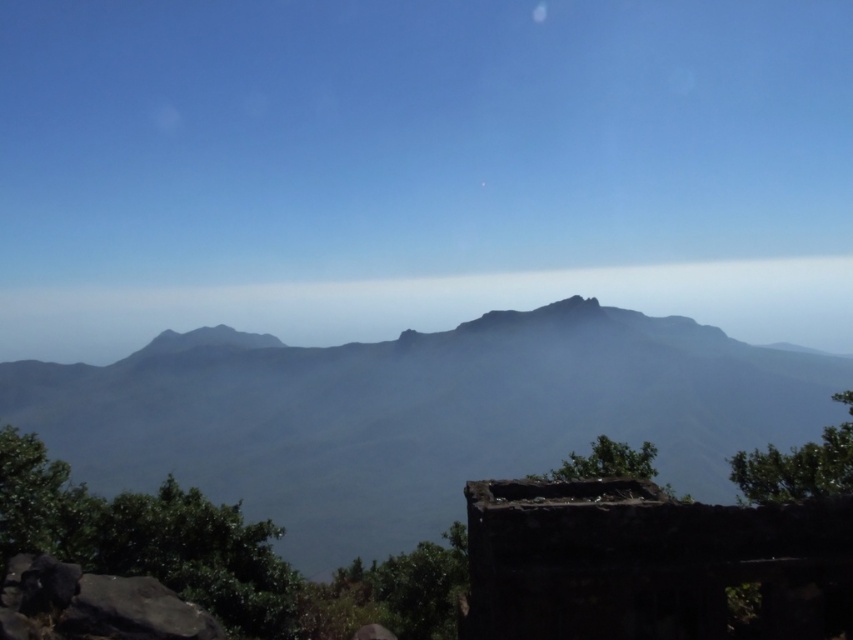
Question: Which object appears closest to the camera in this image?

Choices:
 (A) dark green textured mountain range at center
 (B) gray matte mountain at center

Answer: (A)

Question: Considering the relative positions of dark green textured mountain range at center and gray matte mountain at center in the image provided, where is dark green textured mountain range at center located with respect to gray matte mountain at center?

Choices:
 (A) left
 (B) right

Answer: (A)

Question: From the image, what is the correct spatial relationship of dark green textured mountain range at center in relation to gray matte mountain at center?

Choices:
 (A) right
 (B) left

Answer: (B)

Question: Is dark green textured mountain range at center smaller than gray matte mountain at center?

Choices:
 (A) no
 (B) yes

Answer: (B)

Question: Which point is farther from the camera taking this photo?

Choices:
 (A) (51, 294)
 (B) (677, 440)

Answer: (A)

Question: Which object is closer to the camera taking this photo?

Choices:
 (A) dark green textured mountain range at center
 (B) gray matte mountain at center

Answer: (A)